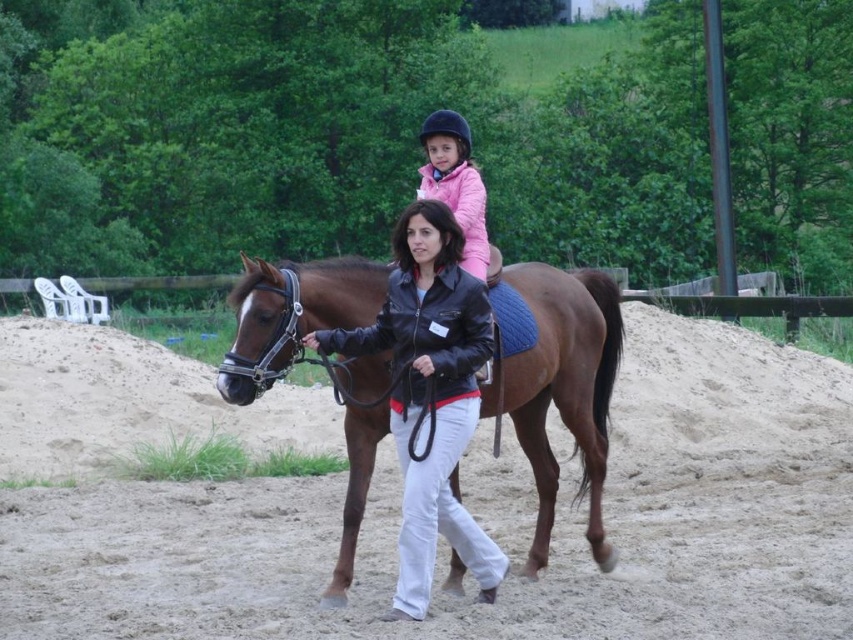
Between brown glossy horse at center and black leather jacket at center, which one appears on the left side from the viewer's perspective?

black leather jacket at center is more to the left.

Can you confirm if brown glossy horse at center is wider than black leather jacket at center?

No.

Between point (322, 600) and point (440, 308), which one is positioned behind?

Positioned behind is point (322, 600).

You are a GUI agent. You are given a task and a screenshot of the screen. Output one action in this format:
    pyautogui.click(x=<x>, y=<y>)
    Task: Click on the brown glossy horse at center
    The height and width of the screenshot is (640, 853).
    Given the screenshot: What is the action you would take?
    pyautogui.click(x=556, y=381)

Does sandy brown at lower center appear over brown glossy horse at center?

Actually, sandy brown at lower center is below brown glossy horse at center.

Which is below, sandy brown at lower center or brown glossy horse at center?

sandy brown at lower center is below.

The width and height of the screenshot is (853, 640). I want to click on sandy brown at lower center, so click(398, 500).

Which is in front, point (70, 516) or point (401, 250)?

Point (401, 250)

Based on the photo, does sandy brown at lower center have a lesser height compared to black leather jacket at center?

Correct, sandy brown at lower center is not as tall as black leather jacket at center.

This screenshot has width=853, height=640. I want to click on sandy brown at lower center, so click(x=398, y=500).